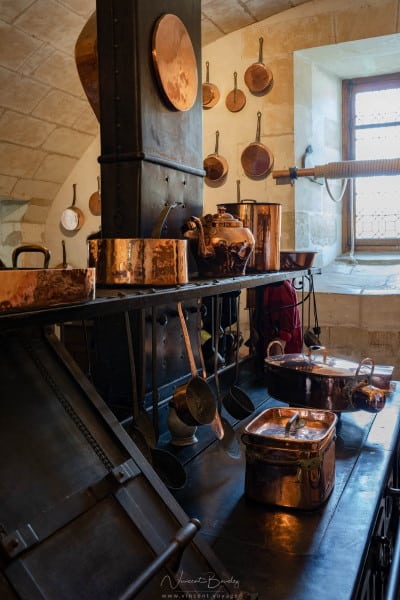
Locate an element on the screen. Image resolution: width=400 pixels, height=600 pixels. window sill is located at coordinates (383, 258).